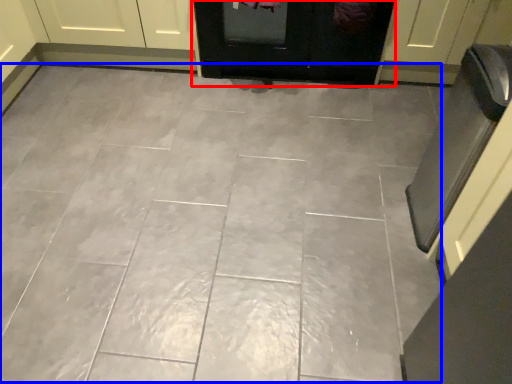
Question: Which object is further to the camera taking this photo, door (highlighted by a red box) or ceramic tile (highlighted by a blue box)?

Choices:
 (A) door
 (B) ceramic tile

Answer: (A)